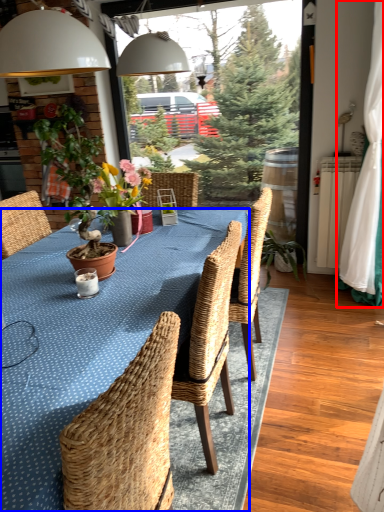
Question: Which object is further to the camera taking this photo, curtain (highlighted by a red box) or kitchen & dining room table (highlighted by a blue box)?

Choices:
 (A) curtain
 (B) kitchen & dining room table

Answer: (A)